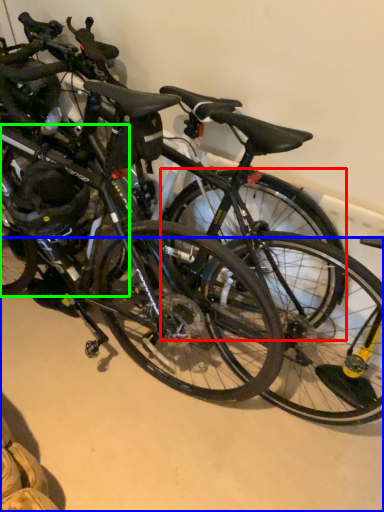
Question: Which object is the closest to the bicycle wheel (highlighted by a red box)? Choose among these: concrete (highlighted by a blue box) or bicycle wheel (highlighted by a green box).

Choices:
 (A) concrete
 (B) bicycle wheel

Answer: (B)